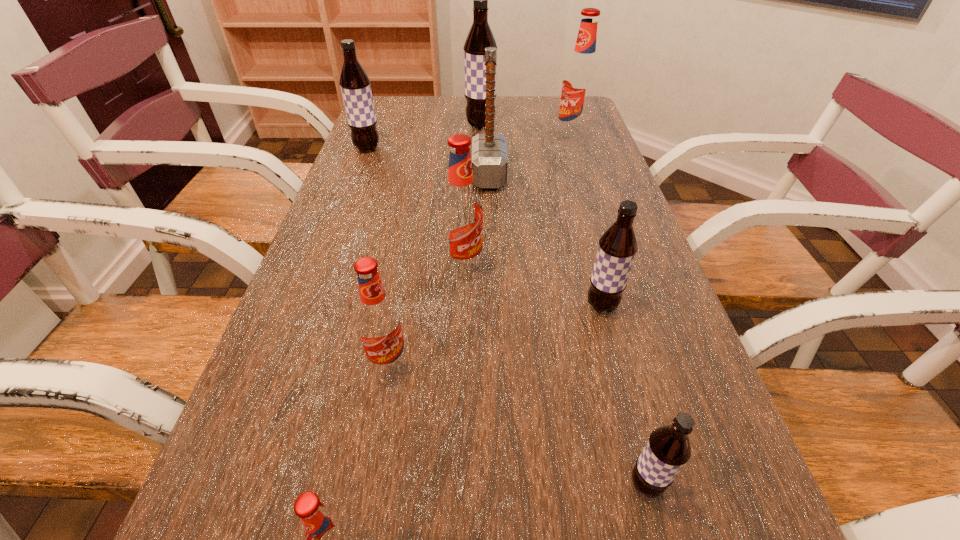
Find the location of `object that can be found as the closest to the sixth farthest root beer`. object that can be found as the closest to the sixth farthest root beer is located at coordinates (461, 208).

Find the location of a particular element. root beer that stands as the sixth closest to the smallest brown root beer is located at coordinates (355, 85).

Where is `the fourth closest root beer to the fourth nearest root beer`? Image resolution: width=960 pixels, height=540 pixels. the fourth closest root beer to the fourth nearest root beer is located at coordinates (328, 539).

Identify the location of brown root beer that is the second closest one to the leftmost root beer. (617, 248).

Identify the location of brown root beer that is the second nearest to the rightmost red root beer. (355, 85).

Identify which red root beer is located as the third nearest to the sixth nearest object. Please provide its 2D coordinates. Your answer should be formatted as a tuple, i.e. [(x, y)], where the tuple contains the x and y coordinates of a point satisfying the conditions above.

[(378, 321)]

At what (x,y) coordinates should I click in order to perform the action: click on red root beer that is the second closest to the third smallest brown root beer. Please return your answer as a coordinate pair (x, y). This screenshot has height=540, width=960. Looking at the image, I should click on (579, 87).

The width and height of the screenshot is (960, 540). I want to click on vacant region that satisfies the following two spatial constraints: 1. on the striking surface of the brown hammer; 2. on the front side of the second farthest red root beer, so click(x=492, y=267).